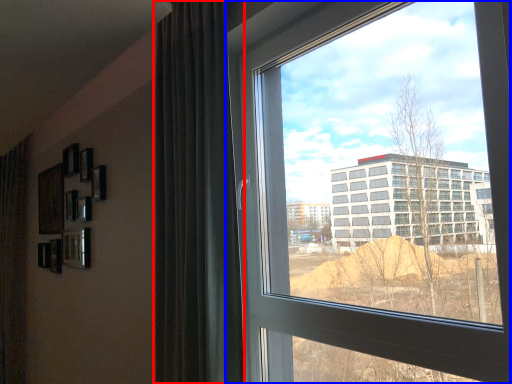
Question: Which point is closer to the camera, curtain (highlighted by a red box) or window (highlighted by a blue box)?

Choices:
 (A) curtain
 (B) window

Answer: (B)